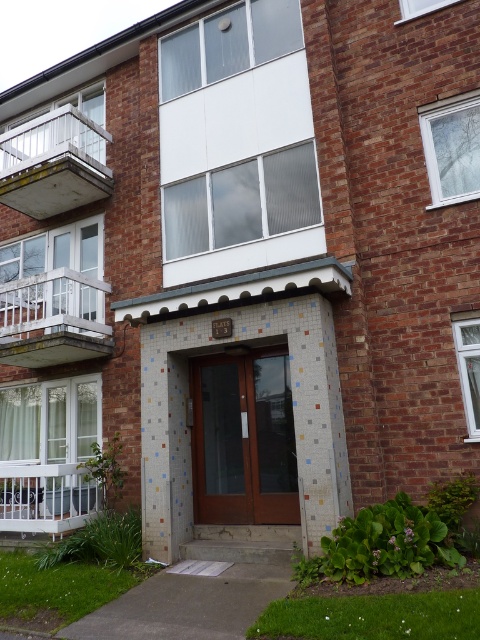
Question: Can you confirm if metallic glass balcony at left is positioned above white glass balcony at left?

Choices:
 (A) no
 (B) yes

Answer: (B)

Question: Which of these objects is positioned closest to the white glass balcony at left?

Choices:
 (A) metallic glass balcony at left
 (B) white painted wood balcony at lower left

Answer: (A)

Question: Which object is farther from the camera taking this photo?

Choices:
 (A) metallic glass balcony at left
 (B) white glass balcony at left
 (C) white painted wood balcony at lower left

Answer: (A)

Question: Is white glass balcony at left closer to the viewer compared to white painted wood balcony at lower left?

Choices:
 (A) no
 (B) yes

Answer: (A)

Question: Does metallic glass balcony at left have a smaller size compared to white glass balcony at left?

Choices:
 (A) no
 (B) yes

Answer: (A)

Question: Which is farther from the metallic glass balcony at left?

Choices:
 (A) white painted wood balcony at lower left
 (B) white glass balcony at left

Answer: (A)